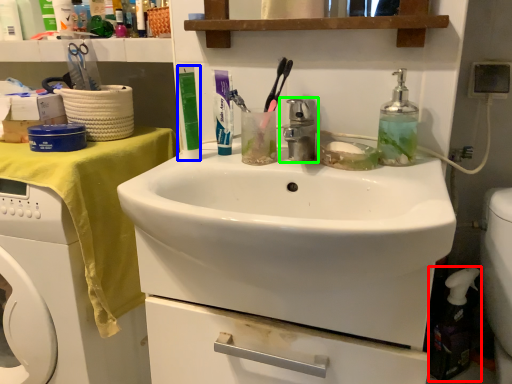
Question: Based on their relative distances, which object is nearer to cleaning product (highlighted by a red box)? Choose from toiletry (highlighted by a blue box) and tap (highlighted by a green box).

Choices:
 (A) toiletry
 (B) tap

Answer: (B)